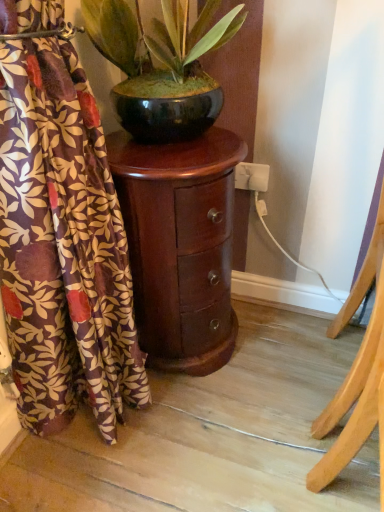
Question: In terms of height, does shiny black pot at upper center look taller or shorter compared to matte floral curtain at left?

Choices:
 (A) short
 (B) tall

Answer: (A)

Question: From a real-world perspective, is shiny black pot at upper center physically located above or below matte floral curtain at left?

Choices:
 (A) above
 (B) below

Answer: (A)

Question: Which object is positioned farthest from the matte floral curtain at left?

Choices:
 (A) light wood easel at right
 (B) shiny dark wood nightstand at center
 (C) shiny black pot at upper center

Answer: (A)

Question: Which object is the closest to the light wood easel at right?

Choices:
 (A) matte floral curtain at left
 (B) shiny black pot at upper center
 (C) shiny dark wood nightstand at center

Answer: (C)